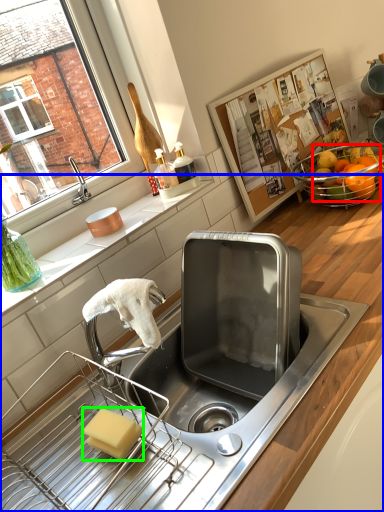
Question: Considering the real-world distances, which object is farthest from fruit (highlighted by a red box)? countertop (highlighted by a blue box) or soap (highlighted by a green box)?

Choices:
 (A) countertop
 (B) soap

Answer: (B)